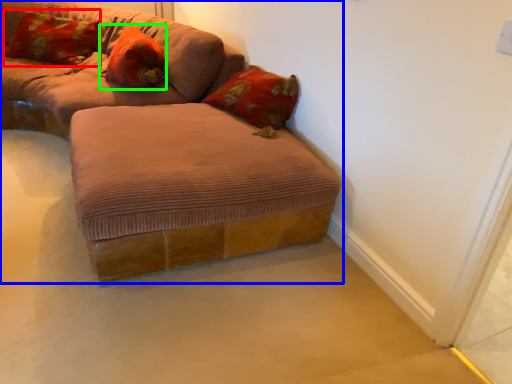
Question: Estimate the real-world distances between objects in this image. Which object is closer to pillow (highlighted by a red box), studio couch (highlighted by a blue box) or pillow (highlighted by a green box)?

Choices:
 (A) studio couch
 (B) pillow

Answer: (B)